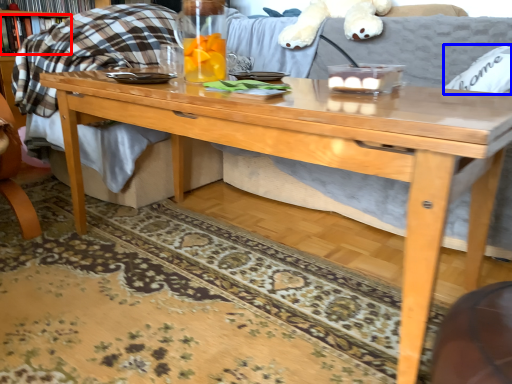
Question: Which object is closer to the camera taking this photo, book (highlighted by a red box) or pillow (highlighted by a blue box)?

Choices:
 (A) book
 (B) pillow

Answer: (B)